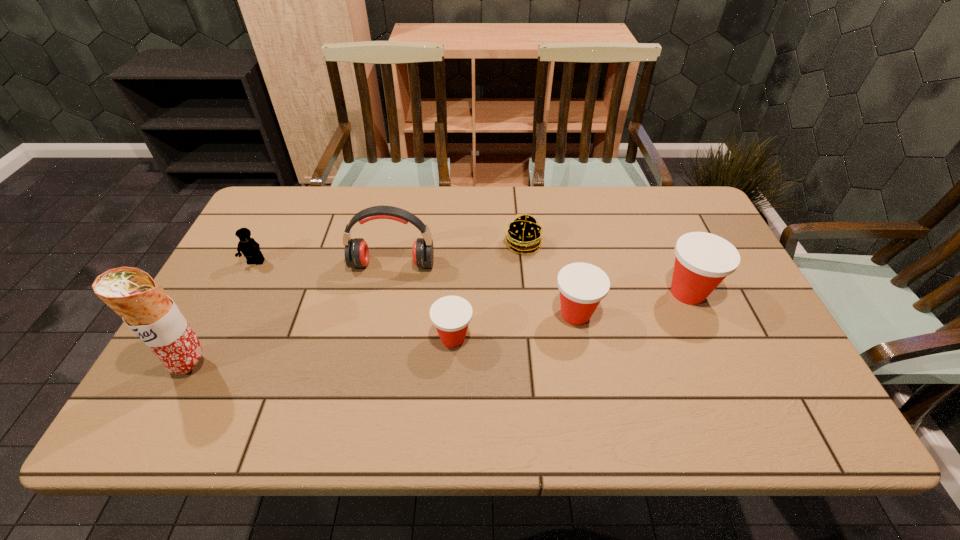
You are a GUI agent. You are given a task and a screenshot of the screen. Output one action in this format:
    pyautogui.click(x=<x>, y=<y>)
    Task: Click on the Dixie cup that is the second closest one to the patty
    Image resolution: width=960 pixels, height=540 pixels.
    Given the screenshot: What is the action you would take?
    pyautogui.click(x=451, y=315)

You are a GUI agent. You are given a task and a screenshot of the screen. Output one action in this format:
    pyautogui.click(x=<x>, y=<y>)
    Task: Click on the closest Dixie cup to the earphone
    This screenshot has height=540, width=960.
    Given the screenshot: What is the action you would take?
    pyautogui.click(x=451, y=315)

Where is `vacant space that satisfies the following two spatial constraints: 1. on the front-facing side of the second Dixie cup from right to left; 2. on the left side of the Lego`? The height and width of the screenshot is (540, 960). vacant space that satisfies the following two spatial constraints: 1. on the front-facing side of the second Dixie cup from right to left; 2. on the left side of the Lego is located at coordinates tap(229, 314).

Image resolution: width=960 pixels, height=540 pixels. I want to click on vacant point that satisfies the following two spatial constraints: 1. on the ear cups of the second tallest object; 2. on the left side of the fourth object from right to left, so click(x=378, y=338).

The width and height of the screenshot is (960, 540). Find the location of `vacant space that satisfies the following two spatial constraints: 1. on the front-facing side of the fourth object from left to right; 2. on the right side of the Lego`. vacant space that satisfies the following two spatial constraints: 1. on the front-facing side of the fourth object from left to right; 2. on the right side of the Lego is located at coordinates (218, 338).

What are the coordinates of `free region that satisfies the following two spatial constraints: 1. on the ear cups of the second tallest object; 2. on the right side of the rightmost object` in the screenshot? It's located at (387, 293).

I want to click on vacant space that satisfies the following two spatial constraints: 1. on the back side of the burrito; 2. on the left side of the second Dixie cup from right to left, so click(x=218, y=314).

I want to click on free space that satisfies the following two spatial constraints: 1. on the ear cups of the second shortest Dixie cup; 2. on the left side of the fifth object from right to left, so click(x=383, y=314).

Identify the location of free spot that satisfies the following two spatial constraints: 1. on the ear cups of the second tallest object; 2. on the right side of the leftmost Dixie cup. Image resolution: width=960 pixels, height=540 pixels. (378, 338).